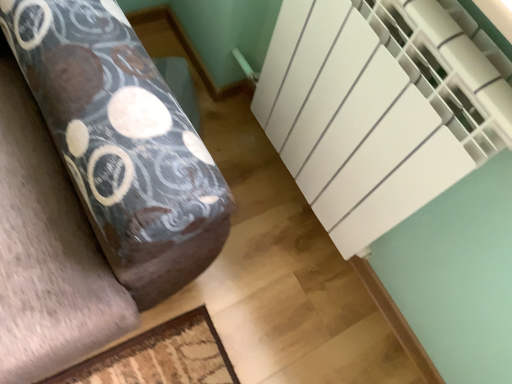
Where is `vacant area on top of white matte radiator at upper right (from a real-world perspective)`? The width and height of the screenshot is (512, 384). vacant area on top of white matte radiator at upper right (from a real-world perspective) is located at coordinates (244, 261).